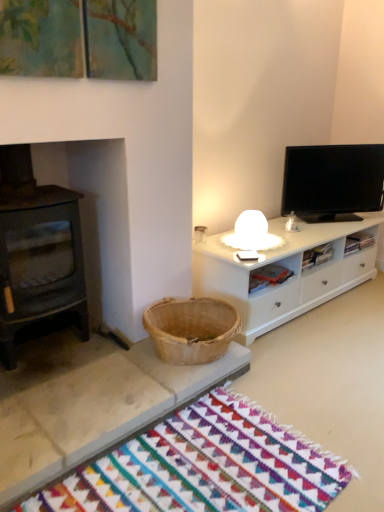
Question: Does point (264, 460) appear closer or farther from the camera than point (312, 150)?

Choices:
 (A) closer
 (B) farther

Answer: (A)

Question: Is multicolored woven mat at lower center to the left or to the right of black glossy tv at upper right in the image?

Choices:
 (A) right
 (B) left

Answer: (B)

Question: From a real-world perspective, is multicolored woven mat at lower center positioned above or below black glossy tv at upper right?

Choices:
 (A) below
 (B) above

Answer: (A)

Question: In the image, is black glossy tv at upper right on the left side or the right side of multicolored woven mat at lower center?

Choices:
 (A) right
 (B) left

Answer: (A)

Question: From the image's perspective, is black glossy tv at upper right positioned above or below multicolored woven mat at lower center?

Choices:
 (A) above
 (B) below

Answer: (A)

Question: Considering their positions, is black glossy tv at upper right located in front of or behind multicolored woven mat at lower center?

Choices:
 (A) behind
 (B) front

Answer: (A)

Question: From a real-world perspective, is black glossy tv at upper right positioned above or below multicolored woven mat at lower center?

Choices:
 (A) above
 (B) below

Answer: (A)